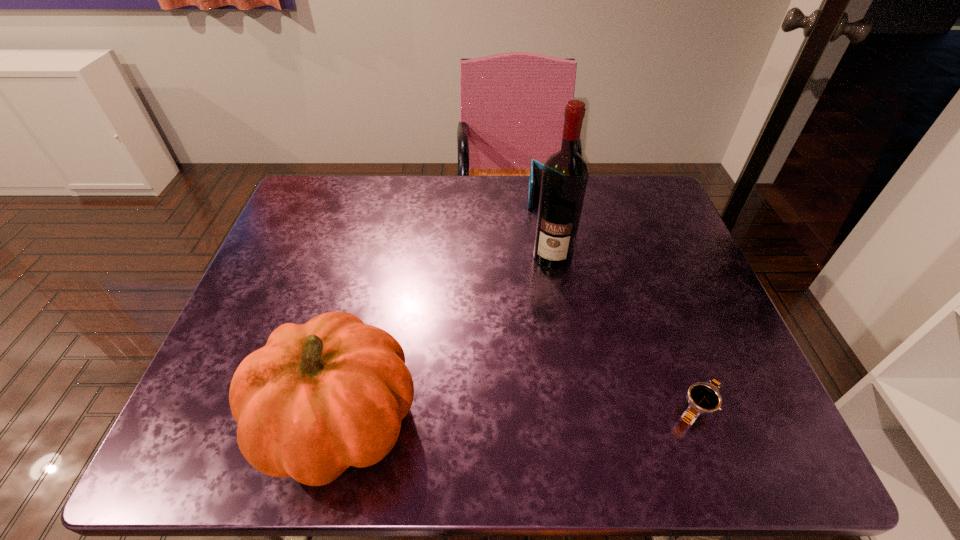
Where is `pumpkin`? This screenshot has width=960, height=540. pumpkin is located at coordinates (319, 397).

I want to click on the leftmost object, so click(319, 397).

Locate an element on the screen. the shortest object is located at coordinates (703, 397).

Identify the location of watch. This screenshot has width=960, height=540. (703, 397).

Find the location of `alcohol`. alcohol is located at coordinates (565, 174).

This screenshot has width=960, height=540. I want to click on the second farthest object, so click(565, 174).

Where is `the farthest object`? The height and width of the screenshot is (540, 960). the farthest object is located at coordinates (536, 168).

Locate an element on the screen. wallet is located at coordinates (536, 168).

I want to click on free space located on the back of the leftmost object, so click(366, 308).

I want to click on free spot located 0.050m on the right of the shortest object, so click(x=748, y=408).